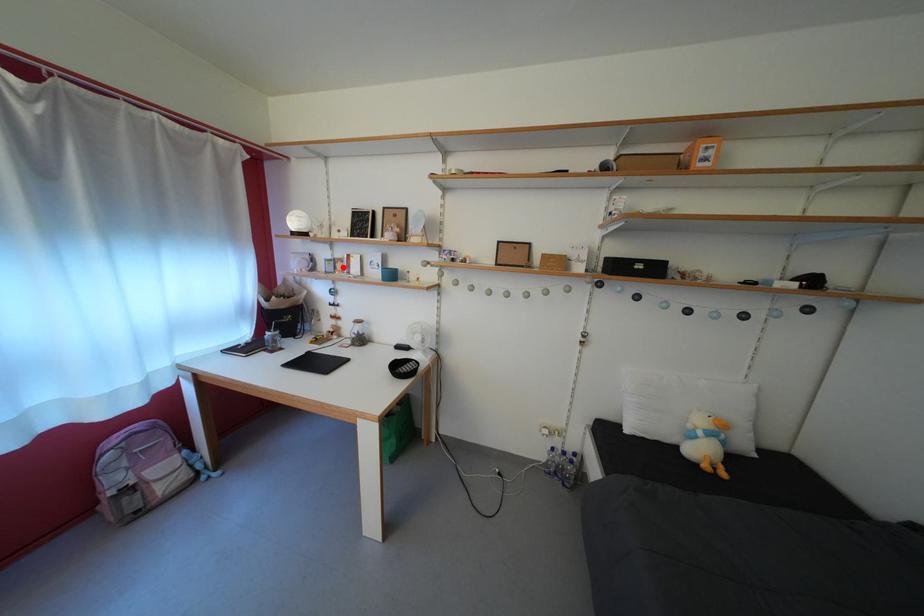
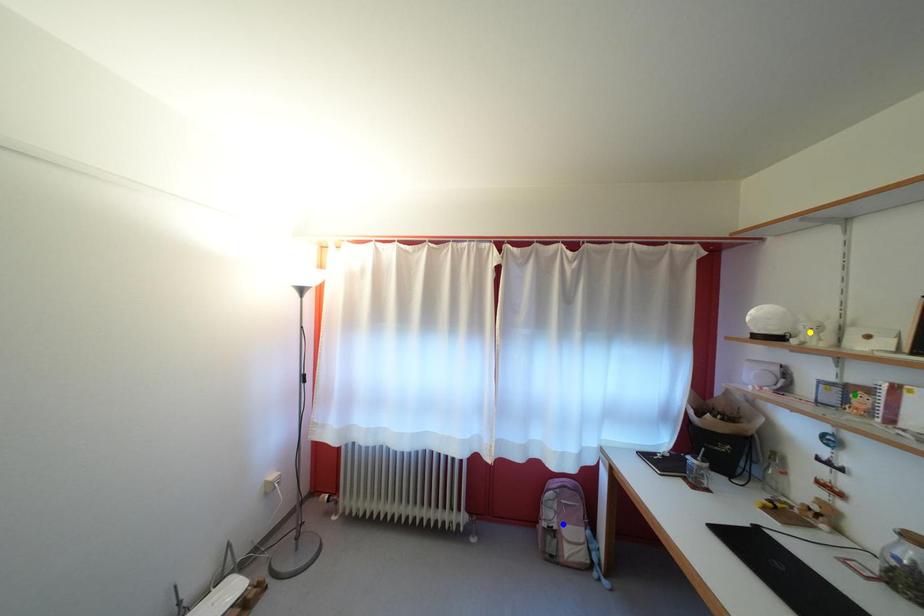
Question: I am providing you with two images of the same scene from different viewpoints. A red point is marked on the first image. You are given multiple points on the second image. In image 2, which mark is for the same physical point as the one in image 1?

Choices:
 (A) blue point
 (B) yellow point
 (C) green point

Answer: (C)